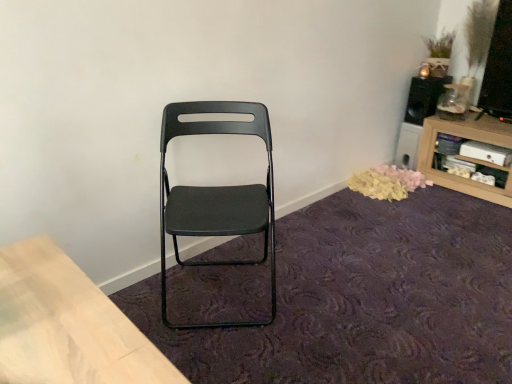
Where is `empty space that is in between matte black folding chair at center and yellow fabric petals at lower right`? empty space that is in between matte black folding chair at center and yellow fabric petals at lower right is located at coordinates (326, 235).